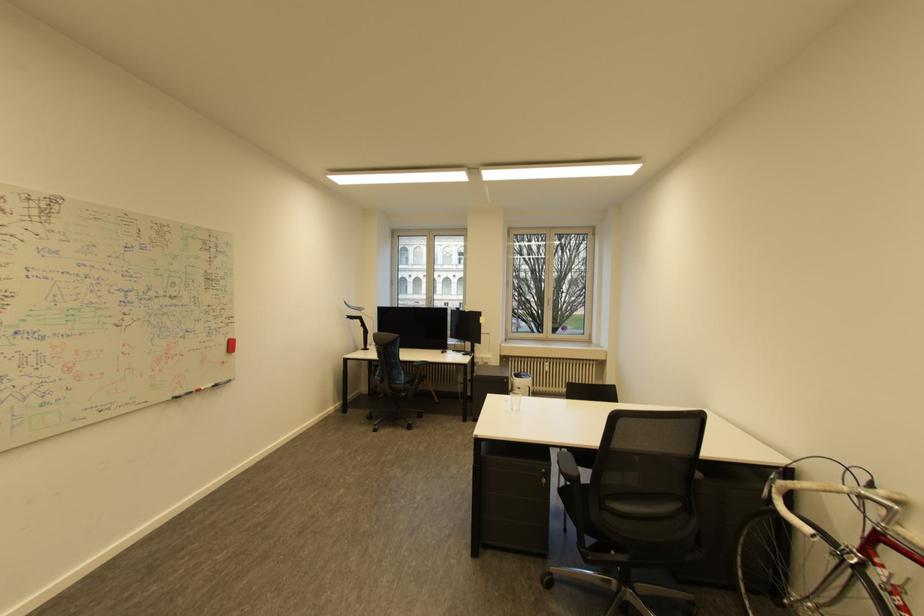
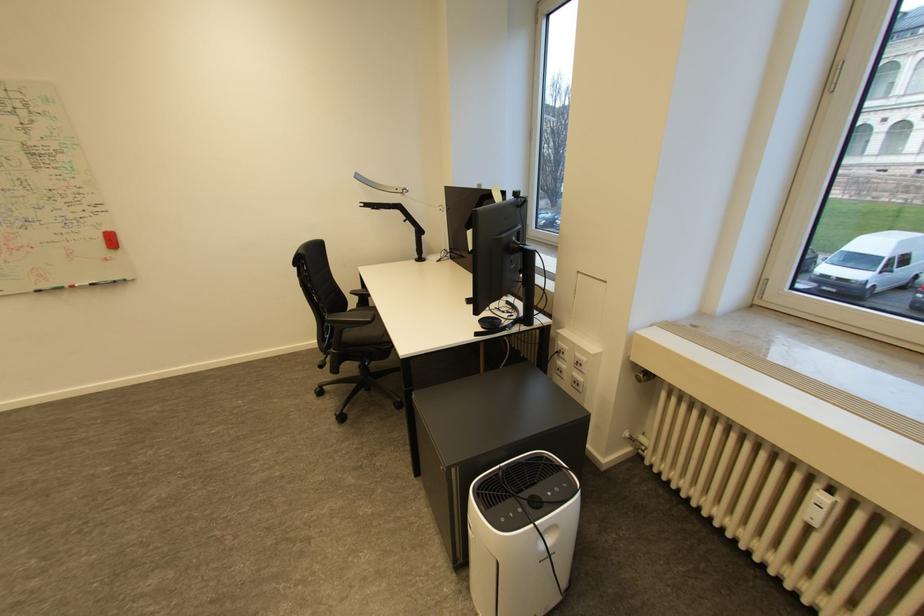
Find the pixel in the second image that matches [553,373] in the first image.

(816, 525)